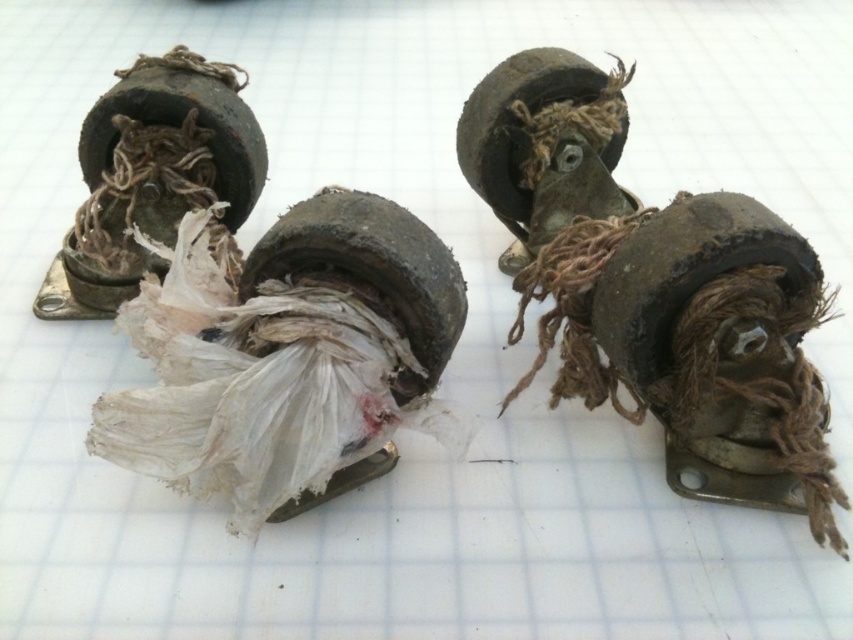
You are an engineer analyzing the placement of objects on a grid. The grid has coordinates from 0 to 1 in both x and y directions. You see the rusty metal roller skate at center. What are its coordinates?

The coordinates of the rusty metal roller skate at center are at point (653, 284).

You are an engineer inspecting a set of roller skate wheels on a grid paper. You notice a point at coordinate [653,284]. What object is located at this coordinate?

The point at coordinate [653,284] indicates the rusty metal roller skate at center.